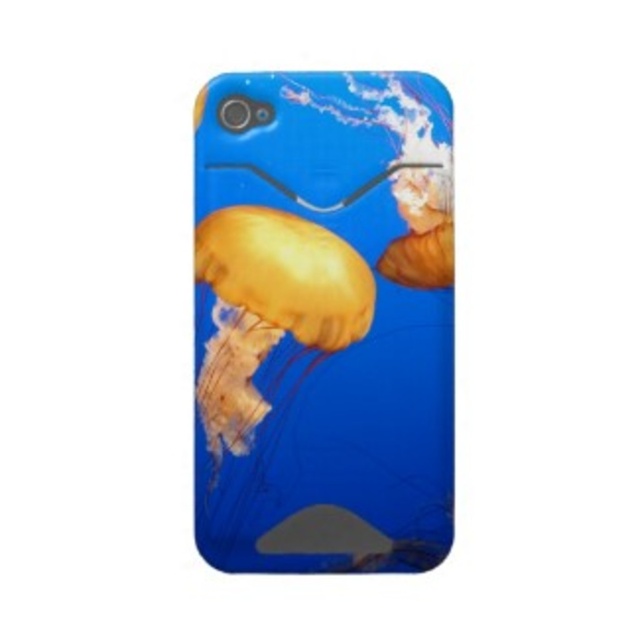
Does translucent plastic jellyfish case at center have a larger size compared to translucent yellow jellyfish at center?

Yes.

The height and width of the screenshot is (640, 640). Describe the element at coordinates (323, 321) in the screenshot. I see `translucent plastic jellyfish case at center` at that location.

Is point (397, 147) less distant than point (240, 316)?

Yes.

The height and width of the screenshot is (640, 640). Find the location of `translucent plastic jellyfish case at center`. translucent plastic jellyfish case at center is located at coordinates (323, 321).